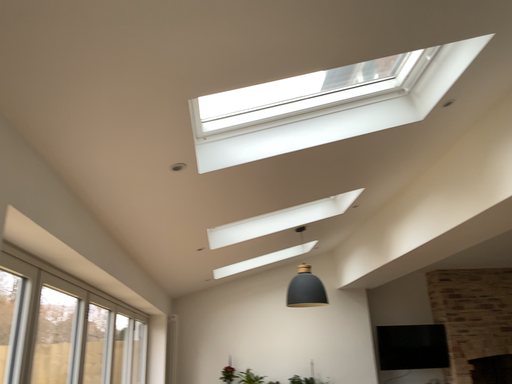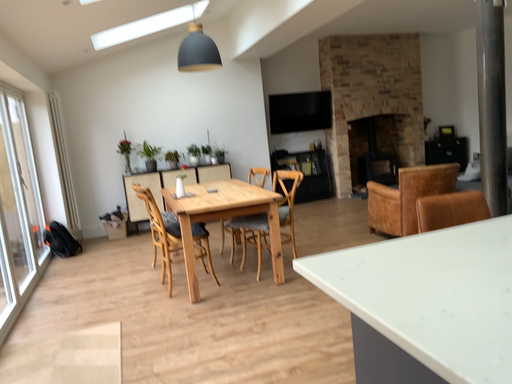
Question: How did the camera likely rotate when shooting the video?

Choices:
 (A) rotated upward
 (B) rotated downward

Answer: (B)